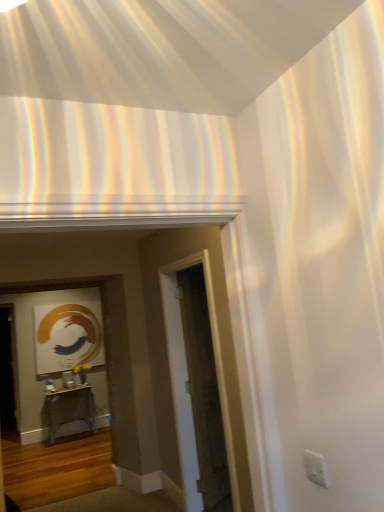
Describe the element at coordinates (69, 409) in the screenshot. I see `metallic silver table at center` at that location.

Measure the distance between point (87, 407) and camera.

The depth of point (87, 407) is 5.71 meters.

Locate an element on the screen. The height and width of the screenshot is (512, 384). metallic silver table at center is located at coordinates (69, 409).

The image size is (384, 512). Describe the element at coordinates (203, 390) in the screenshot. I see `transparent glass door at center` at that location.

In order to click on transparent glass door at center in this screenshot , I will do `click(203, 390)`.

Locate an element on the screen. The width and height of the screenshot is (384, 512). metallic silver table at center is located at coordinates (69, 409).

Based on the photo, considering the positions of objects metallic silver table at center and transparent glass door at center in the image provided, who is more to the right, metallic silver table at center or transparent glass door at center?

Positioned to the right is transparent glass door at center.

Does metallic silver table at center lie behind transparent glass door at center?

Yes, it is behind transparent glass door at center.

Which is nearer, (x=84, y=401) or (x=195, y=347)?

Point (x=195, y=347)

Based on the photo, from the image's perspective, is metallic silver table at center located beneath transparent glass door at center?

Correct, metallic silver table at center appears lower than transparent glass door at center in the image.

From a real-world perspective, relative to transparent glass door at center, is metallic silver table at center vertically above or below?

metallic silver table at center is below transparent glass door at center.

Looking at their sizes, would you say metallic silver table at center is wider or thinner than transparent glass door at center?

Clearly, metallic silver table at center has more width compared to transparent glass door at center.

Considering the relative sizes of metallic silver table at center and transparent glass door at center in the image provided, is metallic silver table at center shorter than transparent glass door at center?

Yes, metallic silver table at center is shorter than transparent glass door at center.

Is metallic silver table at center smaller than transparent glass door at center?

No.

Looking at this image, is metallic silver table at center completely or partially outside of transparent glass door at center?

Yes, metallic silver table at center is located beyond the bounds of transparent glass door at center.

Is metallic silver table at center positioned far away from transparent glass door at center?

That's right, there is a large distance between metallic silver table at center and transparent glass door at center.

Is metallic silver table at center positioned with its back to transparent glass door at center?

No, transparent glass door at center is not at the back of metallic silver table at center.

Where is `glass door in front of the metallic silver table at center`? This screenshot has width=384, height=512. glass door in front of the metallic silver table at center is located at coordinates (203, 390).

Is transparent glass door at center to the left or to the right of metallic silver table at center in the image?

transparent glass door at center is positioned on metallic silver table at center's right side.

Considering the positions of objects transparent glass door at center and metallic silver table at center in the image provided, who is behind, transparent glass door at center or metallic silver table at center?

metallic silver table at center is more distant.

Which is less distant, (207, 328) or (65, 391)?

Clearly, point (207, 328) is closer to the camera than point (65, 391).

From the image's perspective, which one is positioned higher, transparent glass door at center or metallic silver table at center?

transparent glass door at center appears higher in the image.

Looking at this image, from a real-world perspective, is transparent glass door at center physically located above or below metallic silver table at center?

Clearly, from a real-world perspective, transparent glass door at center is above metallic silver table at center.

Is transparent glass door at center wider than metallic silver table at center?

No.

Between transparent glass door at center and metallic silver table at center, which one has more height?

transparent glass door at center.

Can you confirm if transparent glass door at center is bigger than metallic silver table at center?

No.

Would you say transparent glass door at center contains metallic silver table at center?

That's incorrect, metallic silver table at center is not inside transparent glass door at center.

Is transparent glass door at center positioned far away from metallic silver table at center?

transparent glass door at center is positioned a significant distance from metallic silver table at center.

Is transparent glass door at center aimed at metallic silver table at center?

No, transparent glass door at center is not facing towards metallic silver table at center.

At what (x,y) coordinates should I click in order to perform the action: click on table below the transparent glass door at center (from a real-world perspective). Please return your answer as a coordinate pair (x, y). Looking at the image, I should click on (69, 409).

Where is `glass door positioned vertically above the metallic silver table at center (from a real-world perspective)`? glass door positioned vertically above the metallic silver table at center (from a real-world perspective) is located at coordinates (203, 390).

The image size is (384, 512). I want to click on table below the transparent glass door at center (from the image's perspective), so click(x=69, y=409).